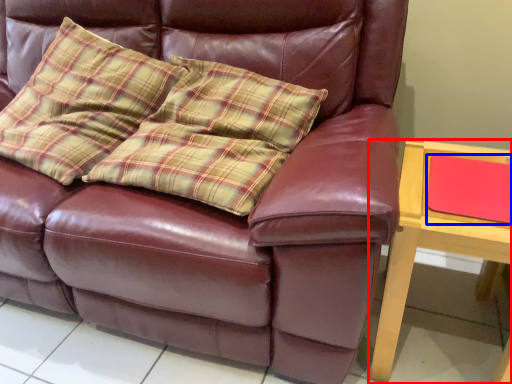
Question: Which of the following is the closest to the observer, table (highlighted by a red box) or pad (highlighted by a blue box)?

Choices:
 (A) table
 (B) pad

Answer: (A)